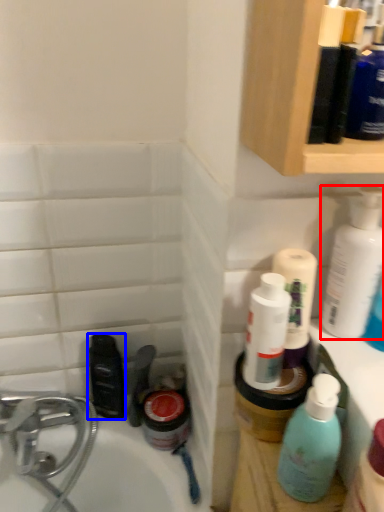
Question: Among these objects, which one is farthest to the camera, cleaning product (highlighted by a red box) or mouthwash (highlighted by a blue box)?

Choices:
 (A) cleaning product
 (B) mouthwash

Answer: (B)